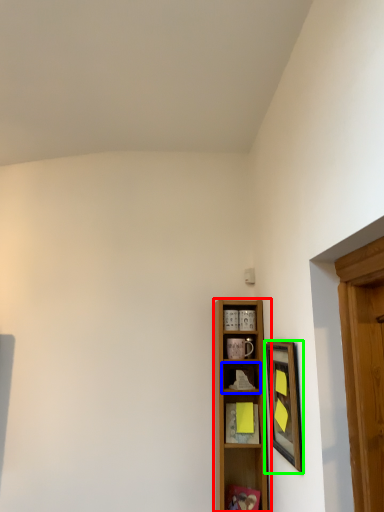
Question: Which is farther away from shelf (highlighted by a red box)? shelf (highlighted by a blue box) or picture frame (highlighted by a green box)?

Choices:
 (A) shelf
 (B) picture frame

Answer: (B)